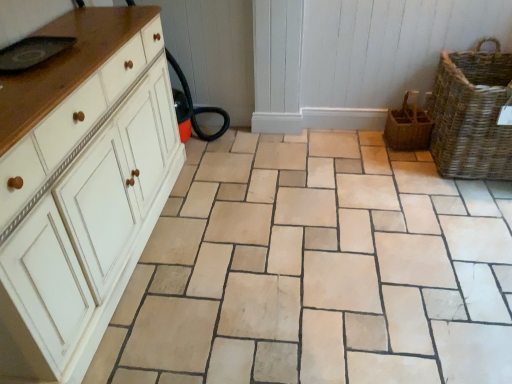
Question: In the image, is white painted wood chest of drawers at left positioned in front of or behind woven brown basket at right, the second basket viewed from the right?

Choices:
 (A) front
 (B) behind

Answer: (A)

Question: From their relative heights in the image, would you say white painted wood chest of drawers at left is taller or shorter than woven brown basket at right, the 1th basket in the left-to-right sequence?

Choices:
 (A) tall
 (B) short

Answer: (A)

Question: Based on their relative distances, which object is nearer to the woven brown basket at right, the 1th basket in the left-to-right sequence?

Choices:
 (A) beige stone tile at center
 (B) woven brown basket at right, the 1th basket viewed from the right
 (C) white painted wood chest of drawers at left

Answer: (B)

Question: Which object is the closest to the woven brown basket at right, the 1th basket viewed from the right?

Choices:
 (A) white painted wood chest of drawers at left
 (B) woven brown basket at right, the 1th basket in the left-to-right sequence
 (C) beige stone tile at center

Answer: (B)